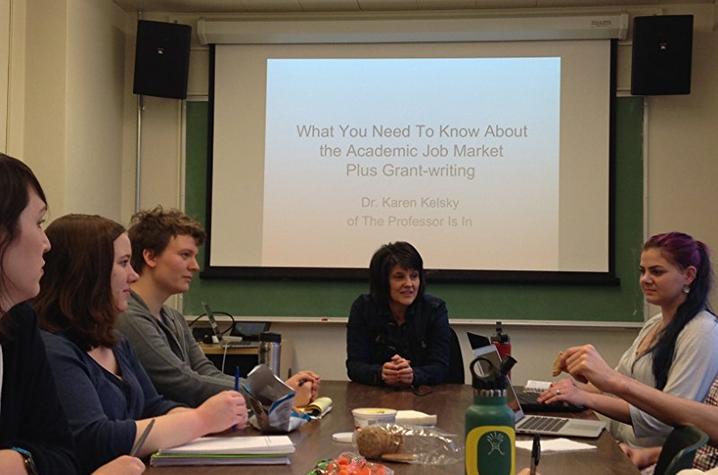
Find the location of `wall behind chalkboard`. wall behind chalkboard is located at coordinates (681, 157), (158, 142).